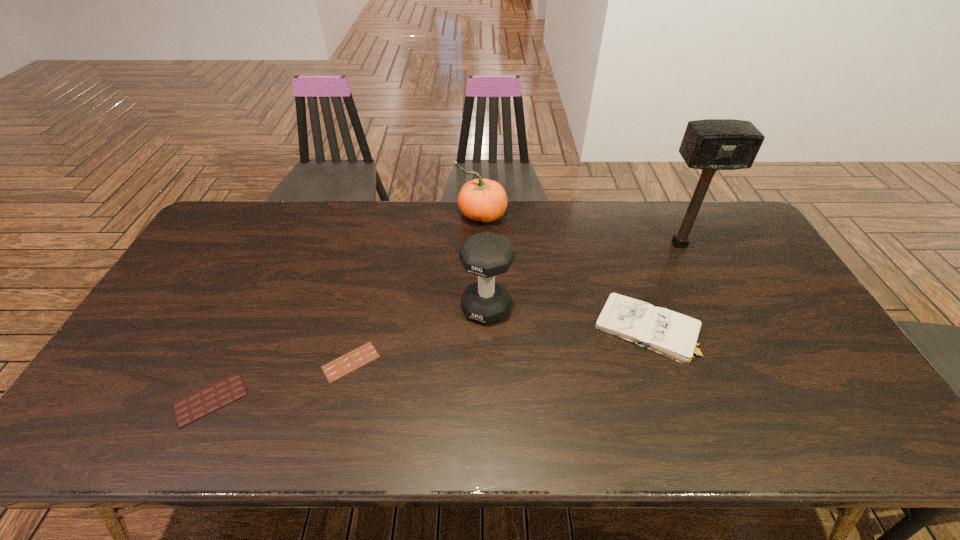
The image size is (960, 540). In order to click on vacant position located 0.230m on the back of the dumbbell in this screenshot , I will do `click(485, 240)`.

What are the coordinates of `vacant space located 0.200m on the front of the notebook` in the screenshot? It's located at (685, 444).

This screenshot has height=540, width=960. In order to click on vacant space located on the back of the leftmost object in this screenshot , I will do `click(247, 323)`.

Identify the location of blank space located on the right of the shortest object. (402, 362).

In order to click on mallet present at the far edge in this screenshot , I will do `click(711, 144)`.

At what (x,y) coordinates should I click in order to perform the action: click on pumpkin located at the far edge. Please return your answer as a coordinate pair (x, y). This screenshot has width=960, height=540. Looking at the image, I should click on (484, 200).

Locate an element on the screen. object that is at the near edge is located at coordinates (191, 408).

Locate an element on the screen. Image resolution: width=960 pixels, height=540 pixels. free space at the far edge of the desktop is located at coordinates (365, 242).

Image resolution: width=960 pixels, height=540 pixels. Identify the location of vacant region at the left edge of the desktop. (136, 371).

You are a GUI agent. You are given a task and a screenshot of the screen. Output one action in this format:
    pyautogui.click(x=<x>, y=<y>)
    Task: Click on the free spot at the right edge of the desktop
    
    Given the screenshot: What is the action you would take?
    pyautogui.click(x=791, y=291)